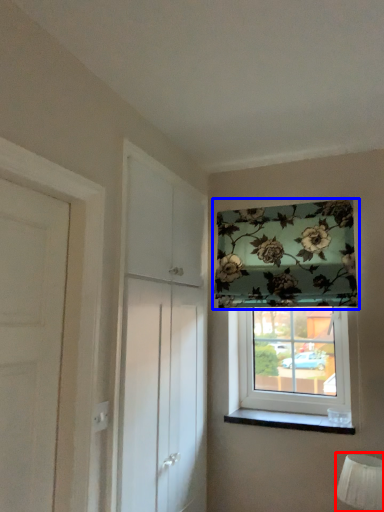
Question: Which object is further to the camera taking this photo, table lamp (highlighted by a red box) or window (highlighted by a blue box)?

Choices:
 (A) table lamp
 (B) window

Answer: (B)